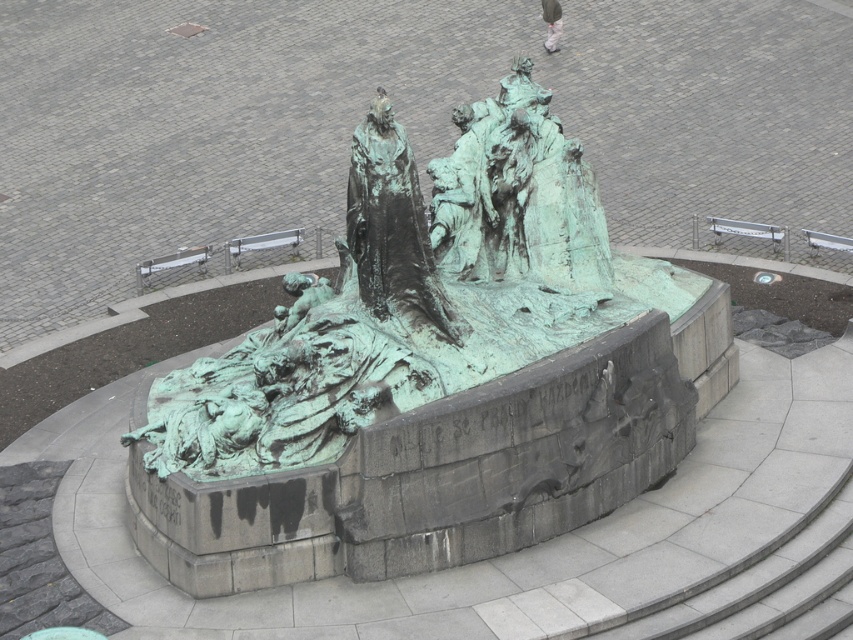
Question: Among these objects, which one is farthest from the camera?

Choices:
 (A) green patina sculpture at center
 (B) green patina statue at center

Answer: (A)

Question: Which object is closer to the camera taking this photo?

Choices:
 (A) green patina sculpture at center
 (B) green patina statue at center

Answer: (B)

Question: Does green patina sculpture at center appear over green patina statue at center?

Choices:
 (A) yes
 (B) no

Answer: (A)

Question: Is green patina sculpture at center wider than green patina statue at center?

Choices:
 (A) no
 (B) yes

Answer: (B)

Question: Does green patina sculpture at center appear on the right side of green patina statue at center?

Choices:
 (A) yes
 (B) no

Answer: (A)